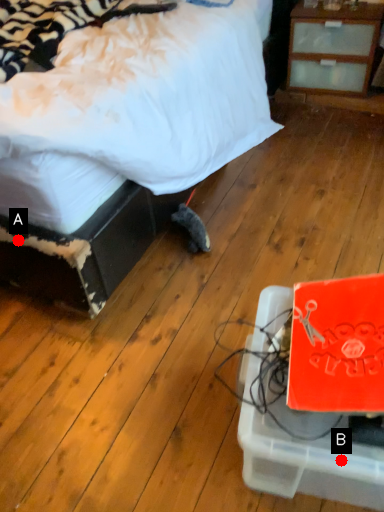
Question: Two points are circled on the image, labeled by A and B beside each circle. Which point is farther to the camera?

Choices:
 (A) A is further
 (B) B is further

Answer: (A)